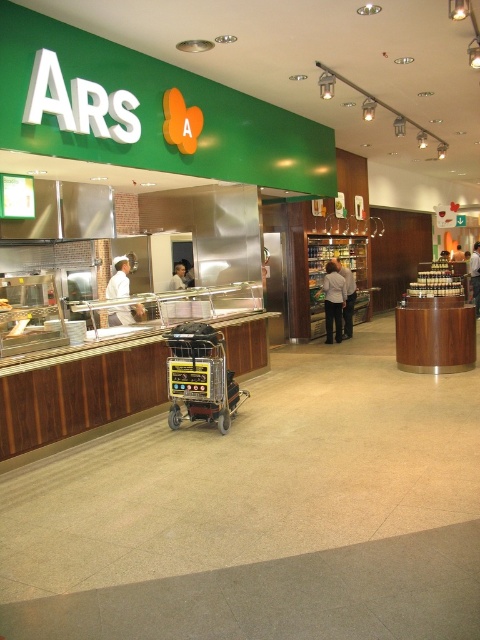
Question: Does white shirt at center have a greater width compared to white uniform at center?

Choices:
 (A) no
 (B) yes

Answer: (A)

Question: Does yellow plastic shopping cart at center have a larger size compared to light gray shirt at center?

Choices:
 (A) no
 (B) yes

Answer: (A)

Question: Does white uniform at center appear on the left side of light gray shirt at center?

Choices:
 (A) yes
 (B) no

Answer: (A)

Question: Which point is closer to the camera?

Choices:
 (A) (352, 280)
 (B) (183, 390)
 (C) (129, 292)

Answer: (B)

Question: Which point is closer to the camera?

Choices:
 (A) light gray shirt at center
 (B) white matte person at center

Answer: (B)

Question: Among these points, which one is farthest from the camera?

Choices:
 (A) (471, 285)
 (B) (186, 285)

Answer: (A)